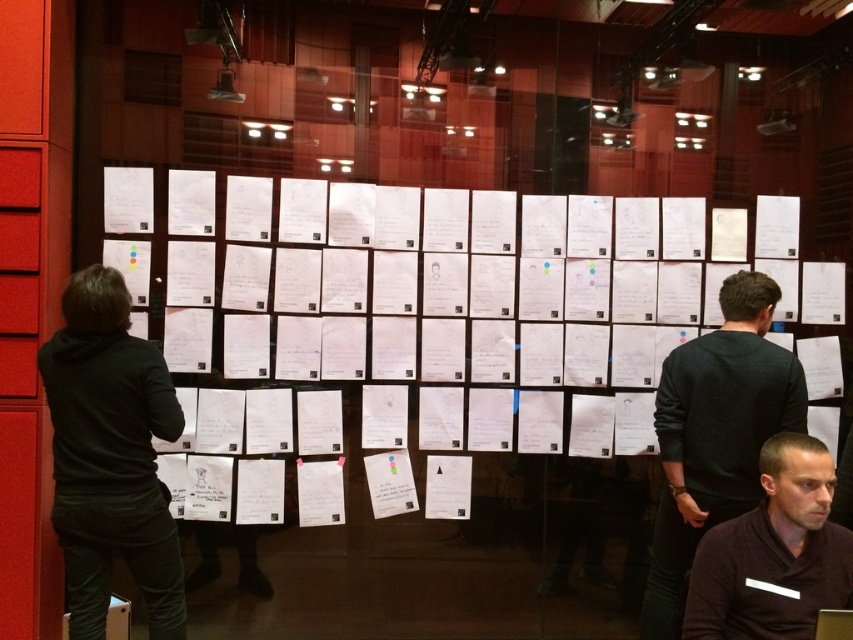
Question: Is black hoodie at left below black sweater at center?

Choices:
 (A) yes
 (B) no

Answer: (B)

Question: Which point is closer to the camera?

Choices:
 (A) dark brown shirt at center
 (B) black sweater at center
 (C) black hoodie at left
 (D) white paper at center

Answer: (A)

Question: Which point is farther to the camera?

Choices:
 (A) dark brown shirt at center
 (B) black sweater at center
 (C) white paper at center
 (D) black hoodie at left

Answer: (C)

Question: Is white paper at center behind black sweater at center?

Choices:
 (A) no
 (B) yes

Answer: (B)

Question: Is the position of white paper at center less distant than that of dark brown shirt at center?

Choices:
 (A) no
 (B) yes

Answer: (A)

Question: Among these objects, which one is nearest to the camera?

Choices:
 (A) black sweater at center
 (B) white paper at center
 (C) dark brown shirt at center

Answer: (C)